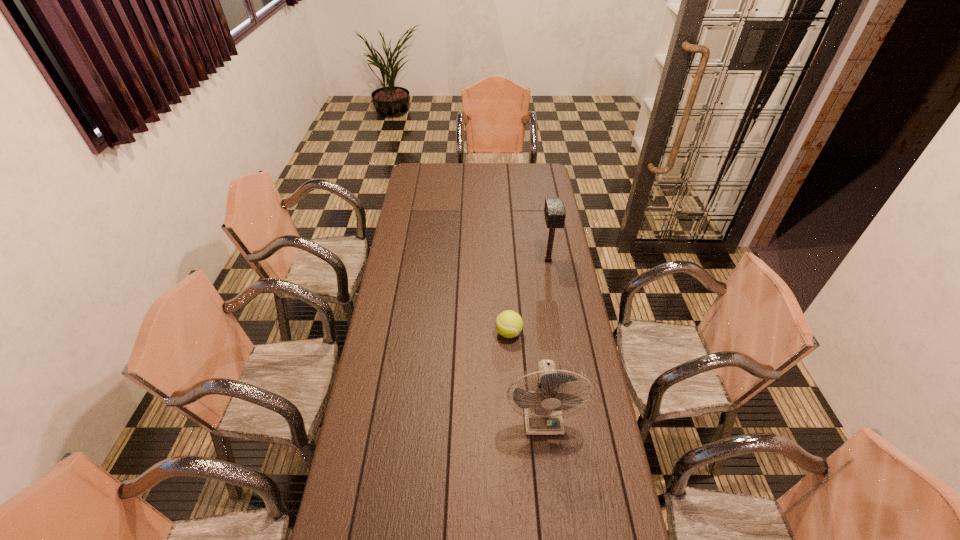
Find the location of a particular element. vacant space that satisfies the following two spatial constraints: 1. on the back side of the second farthest object; 2. on the right side of the farthest object is located at coordinates (504, 260).